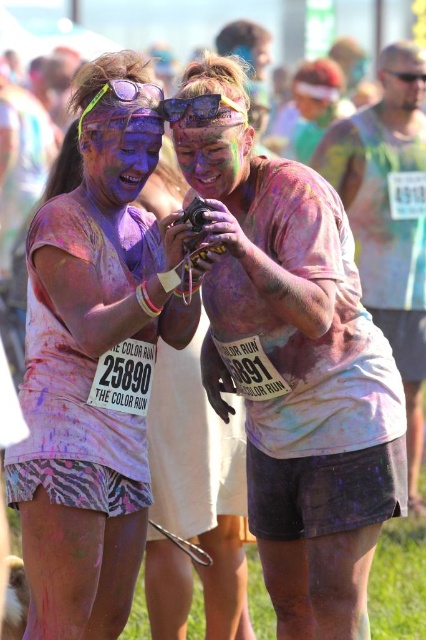
You are a photographer at The Color Run event. You need to capture a photo where both the matte pink shirt at center and the purple matte face at center are clearly visible. Considering their sizes, which object should you focus on to ensure both are in frame?

The matte pink shirt at center is larger in size than the purple matte face at center. To ensure both are in frame, focus on the matte pink shirt at center since it is larger and will be easier to capture while the smaller purple matte face at center remains visible.

You are a photographer at The Color Run event. You need to capture a photo where the purple matte face at center is clearly visible above the multicolored paint face at center. Based on the scene description, can you position your camera to achieve this?

Yes, since the purple matte face at center is taller than the multicolored paint face at center, positioning the camera at a lower angle would ensure the purple matte face at center appears above the multicolored paint face at center in the photo.